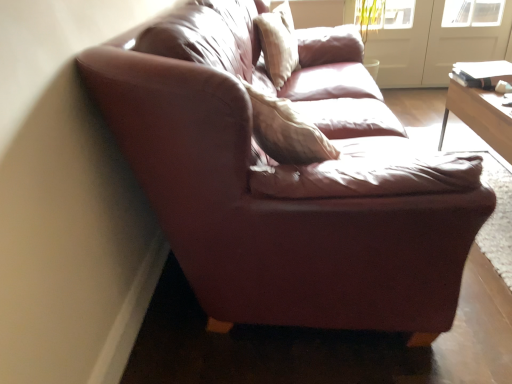
Question: Could you tell me if transparent glass screen door at upper right, which appears as the 1th screen door when viewed from the right, is turned towards white glossy screen door at upper right, the second screen door viewed from the right?

Choices:
 (A) no
 (B) yes

Answer: (A)

Question: Can you confirm if transparent glass screen door at upper right, which appears as the 1th screen door when viewed from the right, is thinner than white glossy screen door at upper right, arranged as the 1th screen door when viewed from the left?

Choices:
 (A) no
 (B) yes

Answer: (A)

Question: Is transparent glass screen door at upper right, which appears as the 1th screen door when viewed from the right, further to the viewer compared to white glossy screen door at upper right, the second screen door viewed from the right?

Choices:
 (A) yes
 (B) no

Answer: (B)

Question: From the image's perspective, is transparent glass screen door at upper right, which is the second screen door from left to right, on white glossy screen door at upper right, arranged as the 1th screen door when viewed from the left?

Choices:
 (A) no
 (B) yes

Answer: (A)

Question: Can you confirm if transparent glass screen door at upper right, which is the second screen door from left to right, is shorter than white glossy screen door at upper right, the second screen door viewed from the right?

Choices:
 (A) yes
 (B) no

Answer: (A)

Question: Considering the relative sizes of transparent glass screen door at upper right, which is the second screen door from left to right, and white glossy screen door at upper right, the second screen door viewed from the right, in the image provided, is transparent glass screen door at upper right, which is the second screen door from left to right, bigger than white glossy screen door at upper right, the second screen door viewed from the right,?

Choices:
 (A) no
 (B) yes

Answer: (B)

Question: Is light beige fabric pillow at upper center oriented away from transparent glass screen door at upper right, which appears as the 1th screen door when viewed from the right?

Choices:
 (A) no
 (B) yes

Answer: (A)

Question: From the image's perspective, does light beige fabric pillow at upper center appear higher than transparent glass screen door at upper right, which appears as the 1th screen door when viewed from the right?

Choices:
 (A) no
 (B) yes

Answer: (A)

Question: Is light beige fabric pillow at upper center positioned in front of transparent glass screen door at upper right, which is the second screen door from left to right?

Choices:
 (A) no
 (B) yes

Answer: (B)

Question: Does light beige fabric pillow at upper center have a lesser width compared to transparent glass screen door at upper right, which is the second screen door from left to right?

Choices:
 (A) yes
 (B) no

Answer: (B)

Question: Considering the relative positions of light beige fabric pillow at upper center and transparent glass screen door at upper right, which is the second screen door from left to right, in the image provided, is light beige fabric pillow at upper center to the left of transparent glass screen door at upper right, which is the second screen door from left to right, from the viewer's perspective?

Choices:
 (A) no
 (B) yes

Answer: (B)

Question: Could you tell me if light beige fabric pillow at upper center is turned towards transparent glass screen door at upper right, which appears as the 1th screen door when viewed from the right?

Choices:
 (A) no
 (B) yes

Answer: (A)

Question: From the image's perspective, does light beige fabric pillow at upper center appear higher than white glossy screen door at upper right, arranged as the 1th screen door when viewed from the left?

Choices:
 (A) no
 (B) yes

Answer: (A)